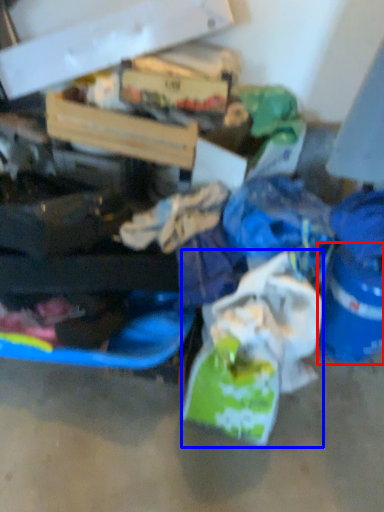
Question: Among these objects, which one is farthest to the camera, bucket (highlighted by a red box) or plastic bag (highlighted by a blue box)?

Choices:
 (A) bucket
 (B) plastic bag

Answer: (A)